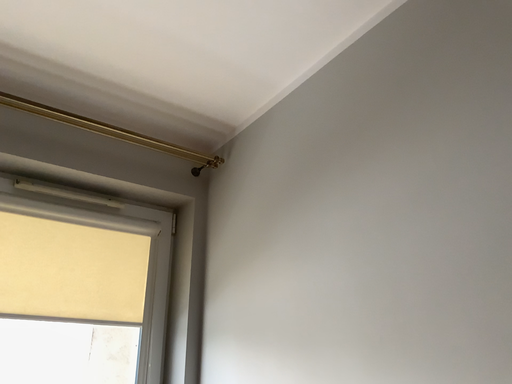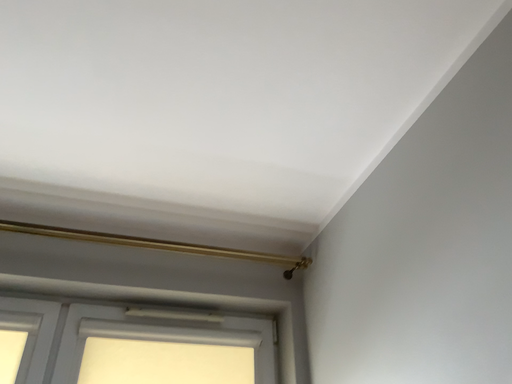
Question: How did the camera likely rotate when shooting the video?

Choices:
 (A) rotated left
 (B) rotated right

Answer: (A)